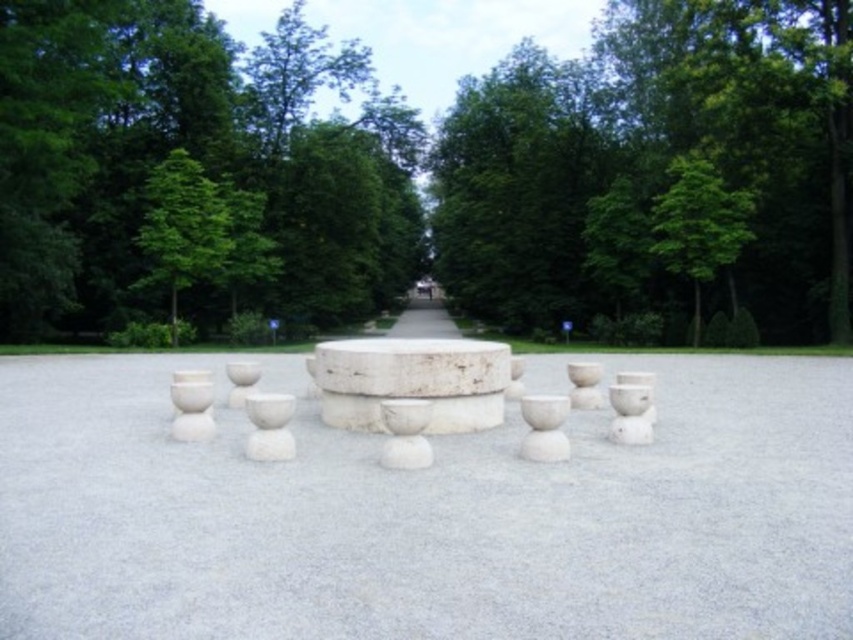
Question: Which point is farther to the camera?

Choices:
 (A) (190, 282)
 (B) (16, 33)
 (C) (682, 193)

Answer: (A)

Question: Is white stone table at center thinner than green leafy tree at upper left?

Choices:
 (A) yes
 (B) no

Answer: (B)

Question: Is white stone table at center wider than green leafy tree at upper left?

Choices:
 (A) no
 (B) yes

Answer: (B)

Question: Does white stone table at center appear on the right side of green leafy tree at upper left?

Choices:
 (A) no
 (B) yes

Answer: (B)

Question: Which object is the farthest from the green leafy tree at upper center?

Choices:
 (A) white stone table at center
 (B) green leafy tree at center
 (C) green leafy tree at upper left
 (D) green leafy tree at upper right

Answer: (A)

Question: Which object is positioned farthest from the white stone table at center?

Choices:
 (A) green leafy tree at center
 (B) green leafy tree at upper center

Answer: (A)